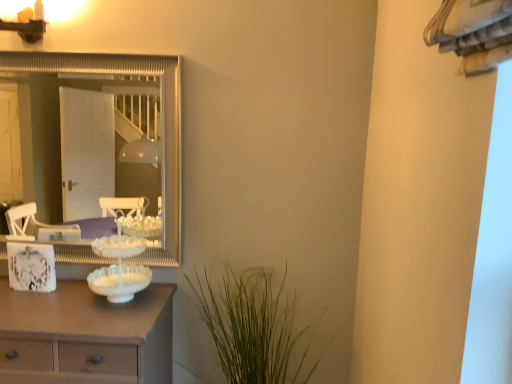
Where is `vacant space to the right of matte white picture frame at left`? This screenshot has width=512, height=384. vacant space to the right of matte white picture frame at left is located at coordinates (67, 297).